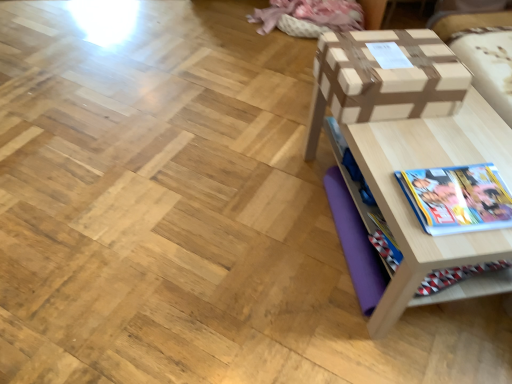
This screenshot has width=512, height=384. What are the coordinates of `unoccupied area in front of hardcover book at lower right` in the screenshot? It's located at (463, 246).